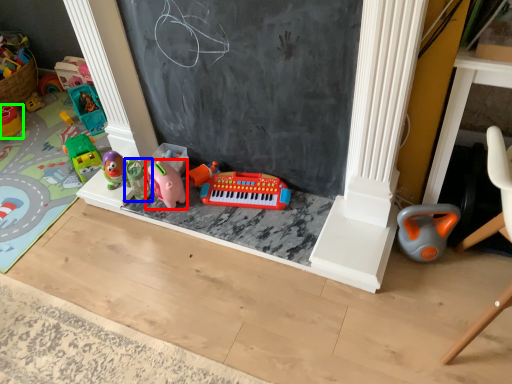
Question: Based on their relative distances, which object is nearer to toy (highlighted by a red box)? Choose from toy (highlighted by a blue box) and toy (highlighted by a green box).

Choices:
 (A) toy
 (B) toy

Answer: (A)